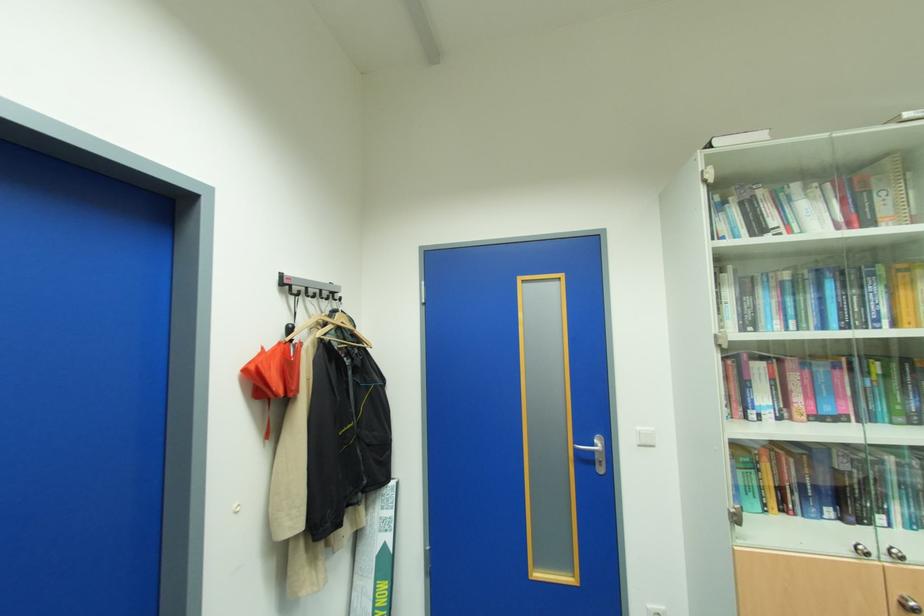
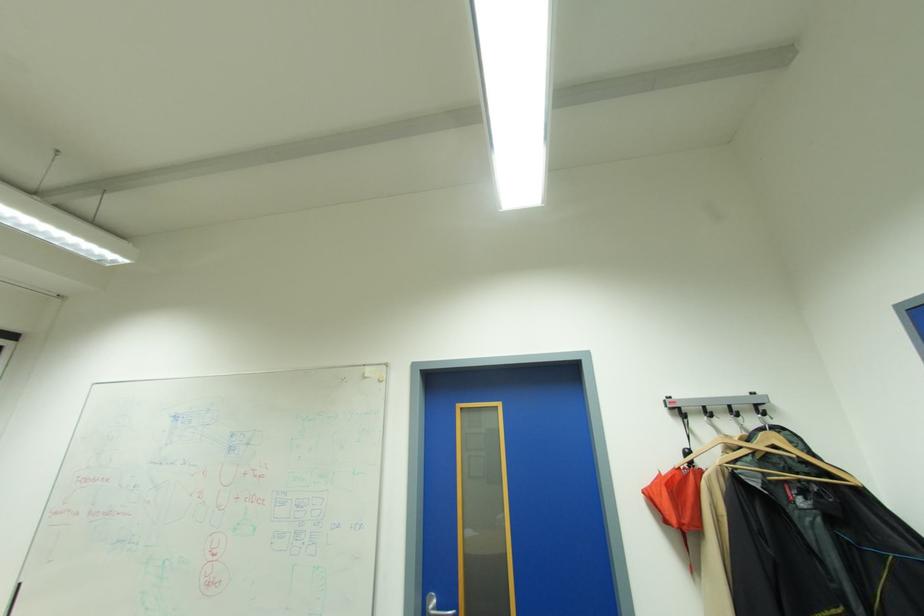
Locate, in the second image, the point that corresponds to point (341, 314) in the first image.

(764, 434)